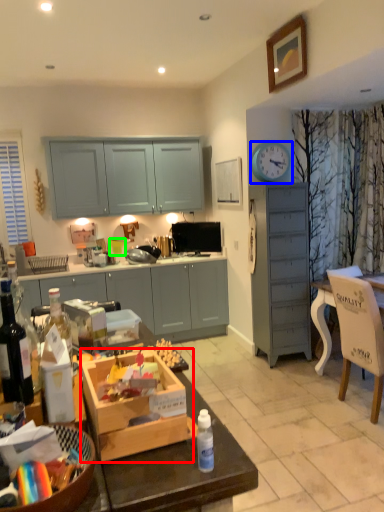
Question: Which is nearer to the cardboard box (highlighted by a red box)? clock (highlighted by a blue box) or coffee cup (highlighted by a green box).

Choices:
 (A) clock
 (B) coffee cup

Answer: (A)